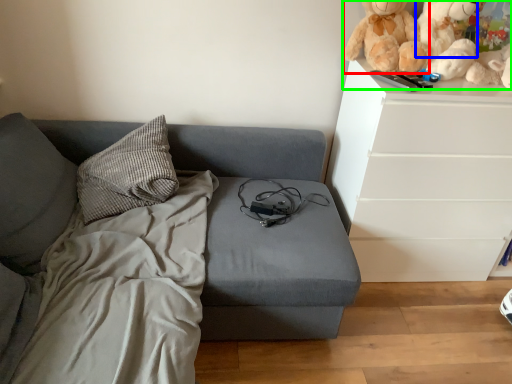
Question: Based on their relative distances, which object is farther from doll (highlighted by a red box)? Choose from teddy (highlighted by a blue box) and toy (highlighted by a green box).

Choices:
 (A) teddy
 (B) toy

Answer: (A)